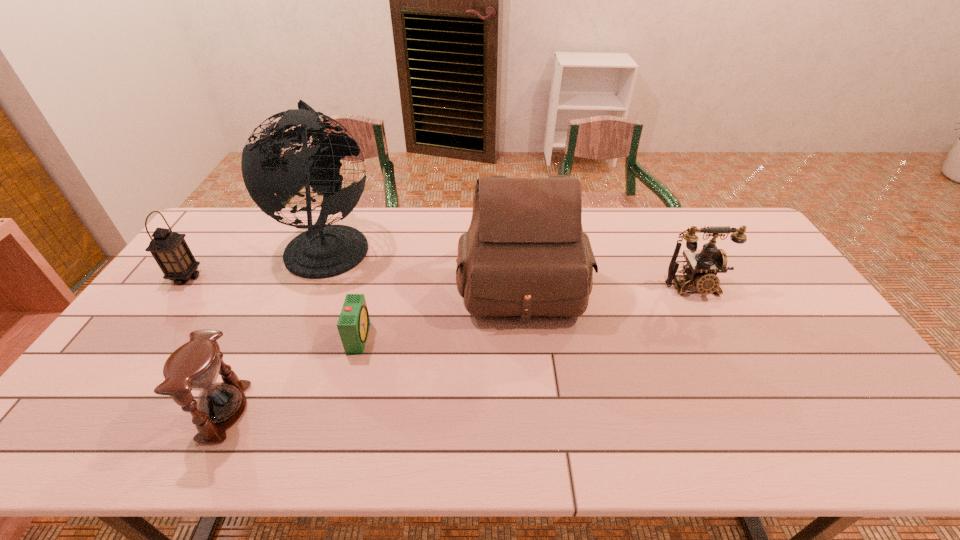
The width and height of the screenshot is (960, 540). I want to click on globe, so tap(323, 251).

Where is `satchel`? satchel is located at coordinates (525, 254).

Where is `the fifth shortest object`? The height and width of the screenshot is (540, 960). the fifth shortest object is located at coordinates [x=525, y=254].

What are the coordinates of `the leftmost object` in the screenshot? It's located at (169, 249).

The image size is (960, 540). What are the coordinates of `telephone` in the screenshot? It's located at (702, 266).

Find the location of a particular element. This screenshot has width=960, height=540. the nearest object is located at coordinates (194, 366).

Where is `the shortest object`? The width and height of the screenshot is (960, 540). the shortest object is located at coordinates (353, 324).

Locate an element on the screen. Image resolution: width=960 pixels, height=540 pixels. vacant space located 0.230m on the front-facing side of the tallest object is located at coordinates (446, 245).

Where is `vacant region located on the front flap of the satchel`? Image resolution: width=960 pixels, height=540 pixels. vacant region located on the front flap of the satchel is located at coordinates (534, 399).

You are a GUI agent. You are given a task and a screenshot of the screen. Output one action in this format:
    pyautogui.click(x=<x>, y=<y>)
    Task: Click on the vacant space located 0.100m on the back of the leftmost object
    
    Given the screenshot: What is the action you would take?
    pyautogui.click(x=206, y=249)